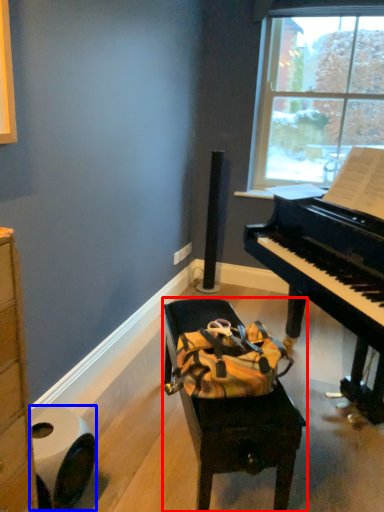
Question: Which object appears closest to the camera in this image, furniture (highlighted by a red box) or toilet paper (highlighted by a blue box)?

Choices:
 (A) furniture
 (B) toilet paper

Answer: (B)